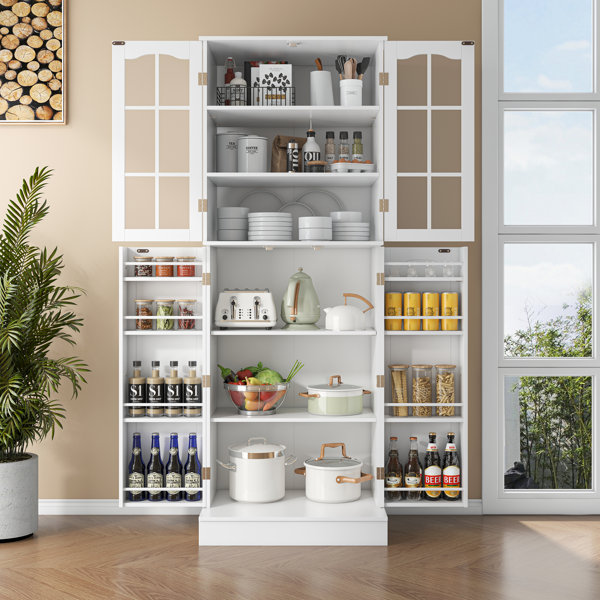
Where is `cooking utensils`? The width and height of the screenshot is (600, 600). cooking utensils is located at coordinates (348, 74), (353, 63), (361, 66), (357, 69), (337, 66), (338, 56), (343, 63).